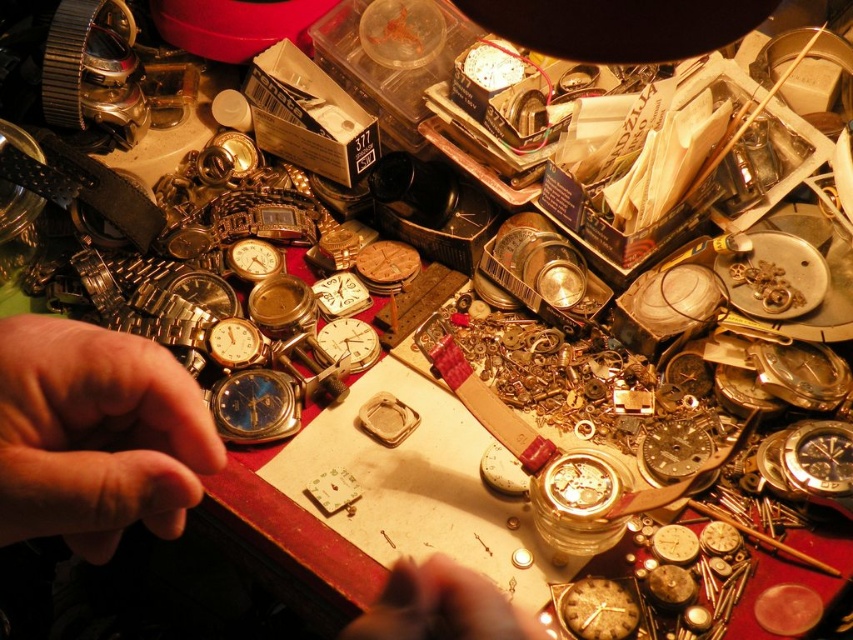
Question: Among these objects, which one is farthest from the camera?

Choices:
 (A) gold textured clock at center
 (B) matte silver watch at center

Answer: (B)

Question: Which of these objects is positioned closest to the matte silver watch at center?

Choices:
 (A) flesh-toned skin at center
 (B) gold textured clock at center
 (C) skinny gold watch at left

Answer: (A)

Question: In this image, where is skinny gold watch at left located relative to matte silver watch at center?

Choices:
 (A) above
 (B) below

Answer: (B)

Question: Which point is farther from the camera taking this photo?

Choices:
 (A) (352, 333)
 (B) (613, 580)
 (C) (149, 378)

Answer: (A)

Question: In this image, where is skinny gold watch at left located relative to flesh-toned skin at center?

Choices:
 (A) above
 (B) below

Answer: (A)

Question: Is skinny gold watch at left in front of gold textured clock at center?

Choices:
 (A) no
 (B) yes

Answer: (B)